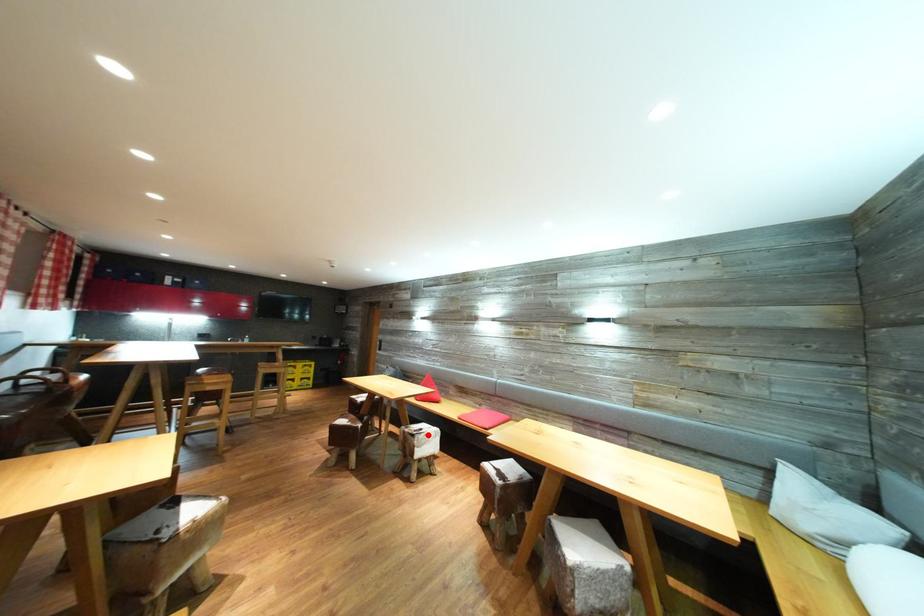
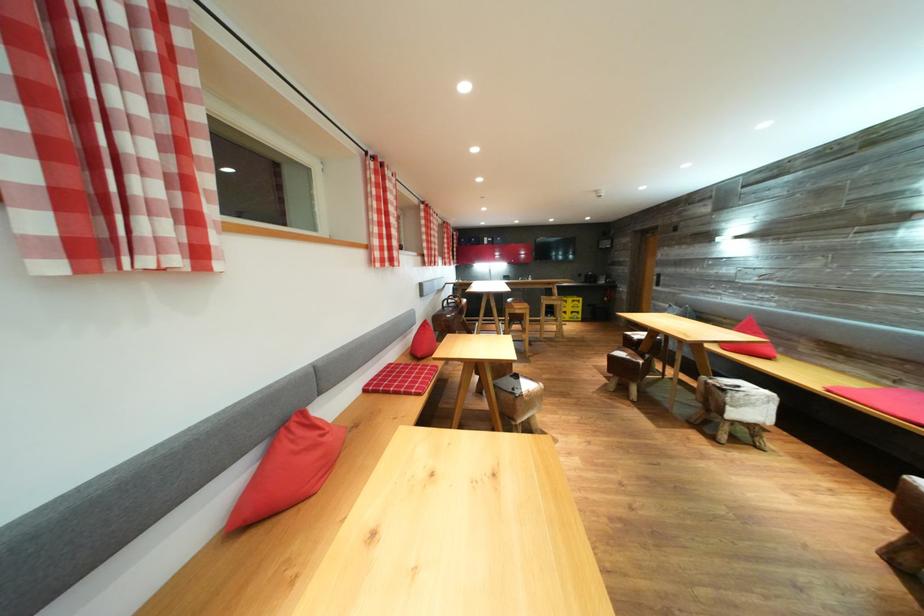
Locate, in the second image, the point that corresponds to the highlighted location in the first image.

(745, 392)